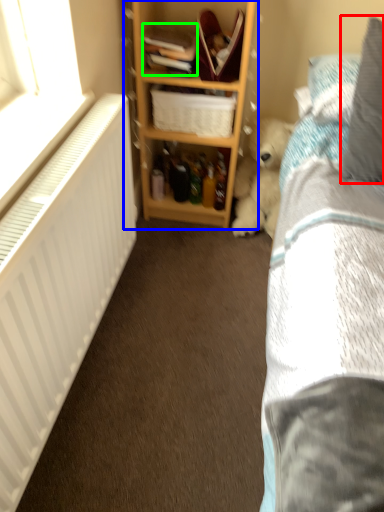
Question: Considering the real-world distances, which object is closest to pillow (highlighted by a red box)? shelf (highlighted by a blue box) or book (highlighted by a green box).

Choices:
 (A) shelf
 (B) book

Answer: (A)